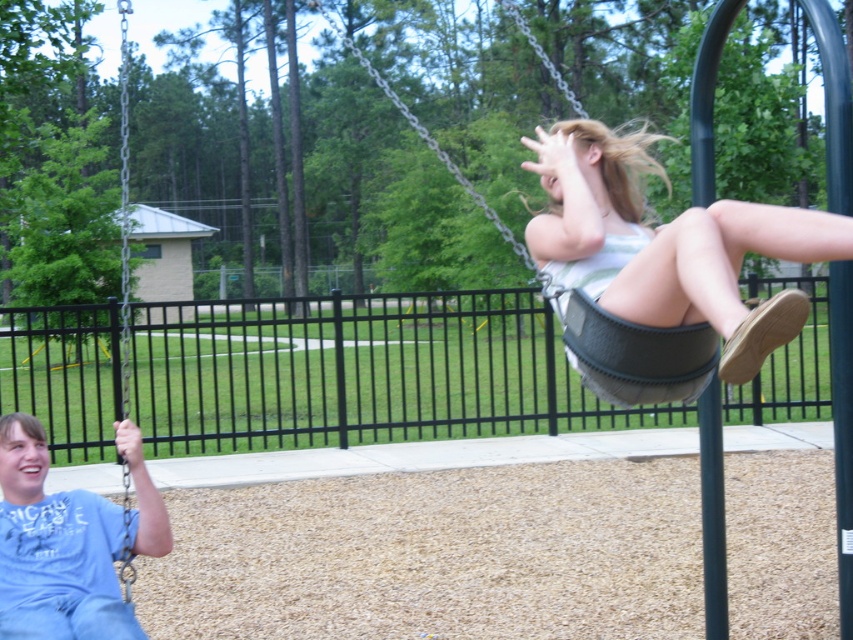
You are standing at the origin point in the playground image. The playground has a coordinate system where the bottom left corner is the origin. Which direction should you move to reach the matte gray swing at center?

The matte gray swing at center is located at coordinate point (666, 243). Since the origin is at the bottom left corner, you should move to the right and upwards to reach it.

You are a parent at the playground and want to choose a swing for your child. The matte gray swing at center and the gray fabric swing at upper right are available. Which swing is closer to you?

The matte gray swing at center is closer to the viewer than the gray fabric swing at upper right, so the matte gray swing at center is closer to you.